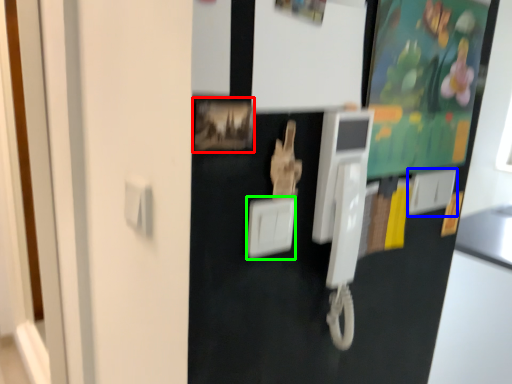
Question: Which object is the closest to the picture frame (highlighted by a red box)? Choose among these: light switch (highlighted by a blue box) or light switch (highlighted by a green box).

Choices:
 (A) light switch
 (B) light switch

Answer: (B)